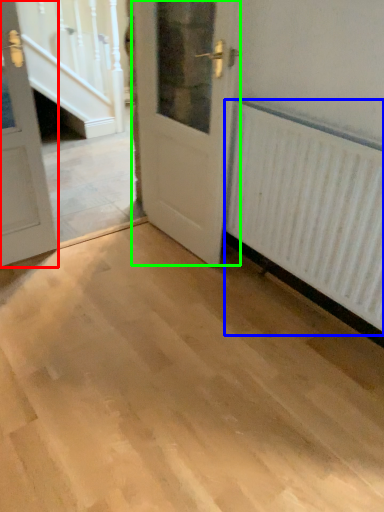
Question: Which object is the farthest from door (highlighted by a red box)? Choose among these: radiator (highlighted by a blue box) or door (highlighted by a green box).

Choices:
 (A) radiator
 (B) door

Answer: (A)